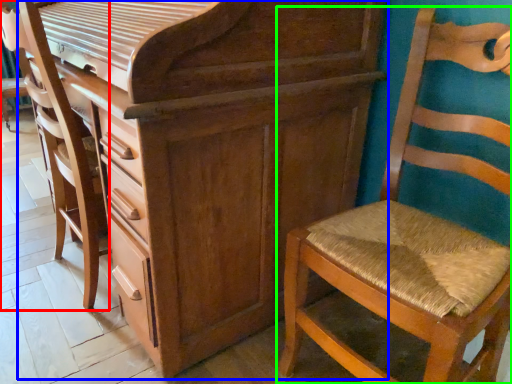
Question: Estimate the real-world distances between objects in this image. Which object is farther from swivel chair (highlighted by a red box), chest of drawers (highlighted by a blue box) or chair (highlighted by a green box)?

Choices:
 (A) chest of drawers
 (B) chair

Answer: (B)